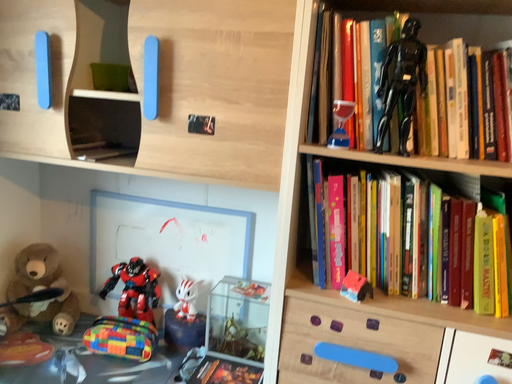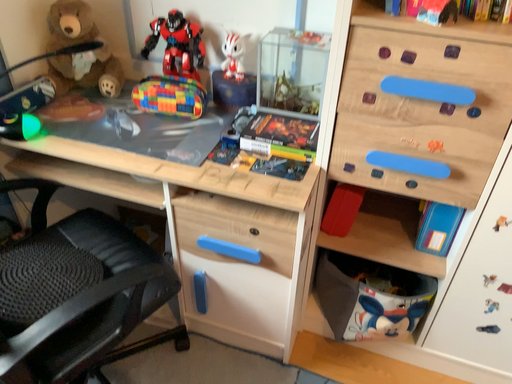
Question: How did the camera likely rotate when shooting the video?

Choices:
 (A) rotated upward
 (B) rotated downward

Answer: (B)